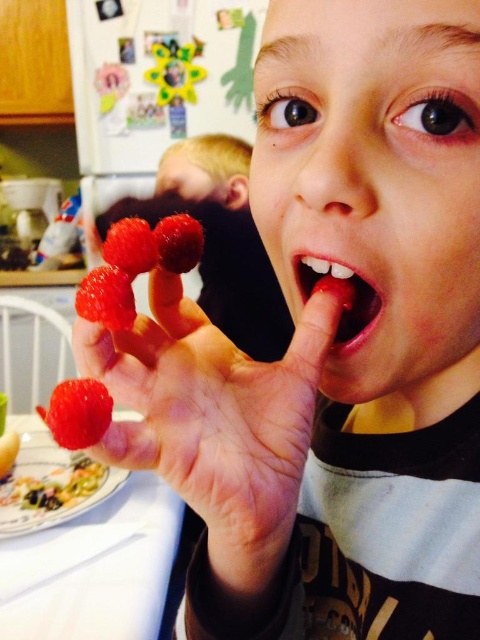
Question: Can you confirm if shiny red raspberries at center is bigger than white glossy plate at lower left?

Choices:
 (A) no
 (B) yes

Answer: (A)

Question: Among these points, which one is farthest from the camera?

Choices:
 (A) (217, 504)
 (B) (343, 337)
 (C) (144, 241)
 (D) (95, 276)

Answer: (B)

Question: Which object is closer to the camera taking this photo?

Choices:
 (A) shiny red raspberries at center
 (B) bright red flesh at mouth center
 (C) white glossy plate at lower left
 (D) smooth red raspberries at lower left

Answer: (A)

Question: Where is bright red flesh at mouth center located in relation to red matte strawberry at center in the image?

Choices:
 (A) left
 (B) right

Answer: (B)

Question: Considering the relative positions of white glossy plate at lower left and red matte strawberry at center in the image provided, where is white glossy plate at lower left located with respect to red matte strawberry at center?

Choices:
 (A) below
 (B) above

Answer: (A)

Question: Based on their relative distances, which object is farther from the shiny red raspberries at center?

Choices:
 (A) bright red strawberry at center
 (B) smooth red raspberries at lower left

Answer: (B)